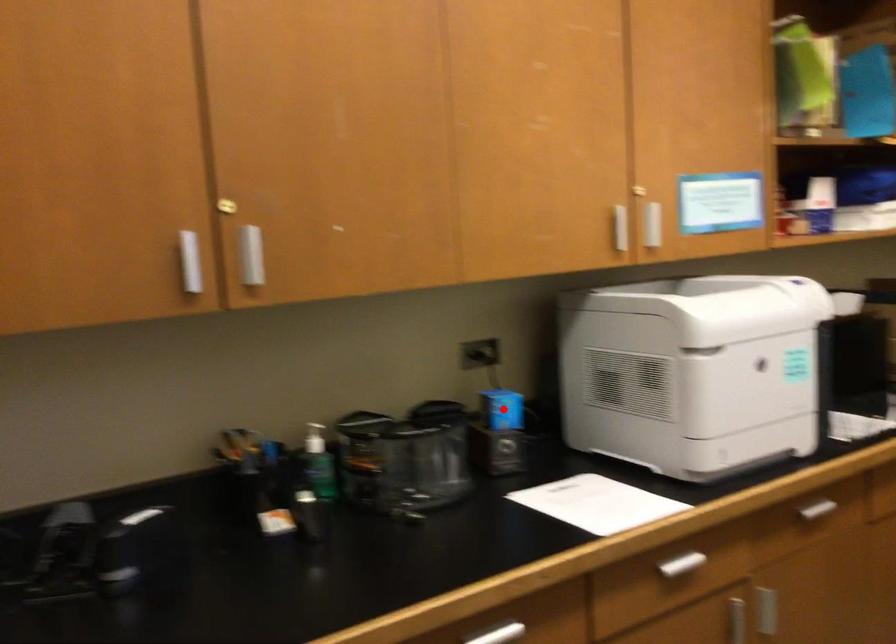
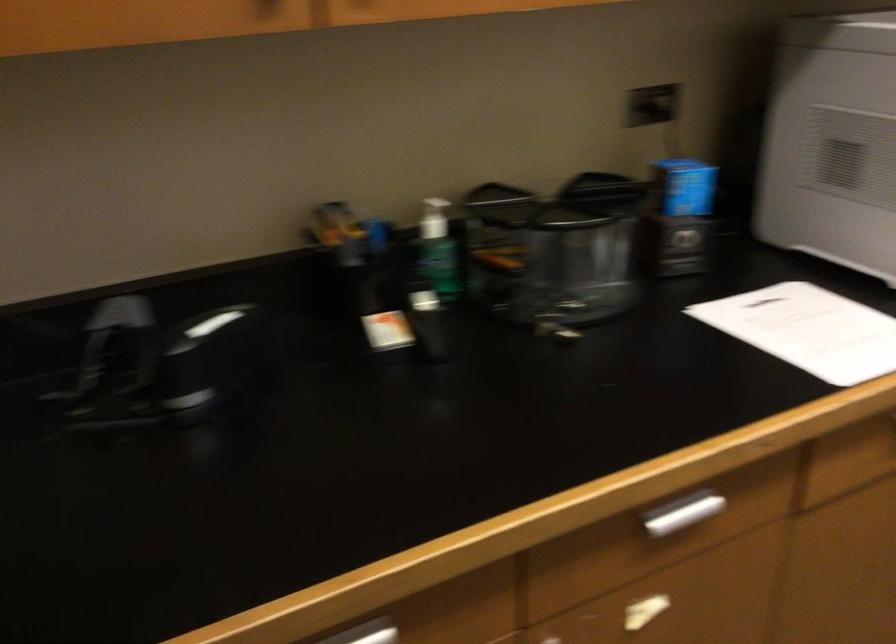
Question: I am providing you with two images of the same scene from different viewpoints. Given a red point in image1, look at the same physical point in image2. Is it:

Choices:
 (A) Closer to the viewpoint
 (B) Farther from the viewpoint

Answer: (A)